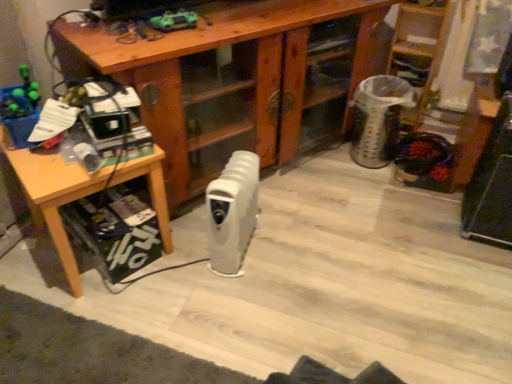
Question: Is wooden table at left located within wooden desk at center?

Choices:
 (A) yes
 (B) no

Answer: (B)

Question: Is the depth of wooden desk at center less than that of wooden table at left?

Choices:
 (A) yes
 (B) no

Answer: (B)

Question: Is wooden table at left at the back of wooden desk at center?

Choices:
 (A) no
 (B) yes

Answer: (A)

Question: Is wooden desk at center aimed at wooden table at left?

Choices:
 (A) yes
 (B) no

Answer: (B)

Question: Can you confirm if wooden desk at center is smaller than wooden table at left?

Choices:
 (A) yes
 (B) no

Answer: (B)

Question: From a real-world perspective, is wooden ladder at upper right above or below wooden desk at center?

Choices:
 (A) below
 (B) above

Answer: (B)

Question: Considering the positions of point (411, 23) and point (87, 31), is point (411, 23) closer or farther from the camera than point (87, 31)?

Choices:
 (A) closer
 (B) farther

Answer: (B)

Question: In terms of height, does wooden ladder at upper right look taller or shorter compared to wooden desk at center?

Choices:
 (A) short
 (B) tall

Answer: (A)

Question: Is wooden ladder at upper right bigger or smaller than wooden desk at center?

Choices:
 (A) small
 (B) big

Answer: (A)

Question: Considering the positions of wooden desk at center and wooden ladder at upper right in the image, is wooden desk at center bigger or smaller than wooden ladder at upper right?

Choices:
 (A) big
 (B) small

Answer: (A)

Question: Looking at their shapes, would you say wooden desk at center is wider or thinner than wooden ladder at upper right?

Choices:
 (A) wide
 (B) thin

Answer: (A)

Question: Is wooden desk at center inside the boundaries of wooden ladder at upper right, or outside?

Choices:
 (A) outside
 (B) inside

Answer: (A)

Question: Would you say wooden desk at center is to the left or to the right of wooden ladder at upper right in the picture?

Choices:
 (A) left
 (B) right

Answer: (A)

Question: Looking at the image, does wooden table at left seem bigger or smaller compared to wooden desk at center?

Choices:
 (A) small
 (B) big

Answer: (A)

Question: Relative to wooden desk at center, is wooden table at left in front or behind?

Choices:
 (A) front
 (B) behind

Answer: (A)